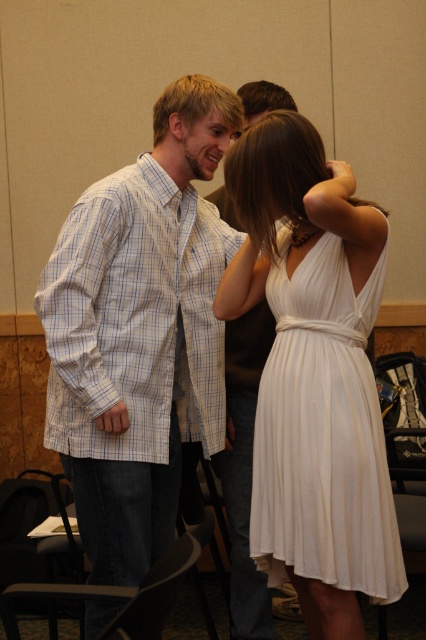
From the picture: You are a photographer positioned at the camera. You want to take a closeup shot of the white pleated dress at center. Can you move closer to the dress to get a better shot without exceeding the 2.00 meters distance limit?

The distance between the white pleated dress at center and the camera is 2.00 meters. Since the limit is 2.00 meters, you cannot move closer than that distance to take the photo.

Where is the checkered fabric shirt at center located in the image?

The checkered fabric shirt at center is located at point (134, 314) in the image.